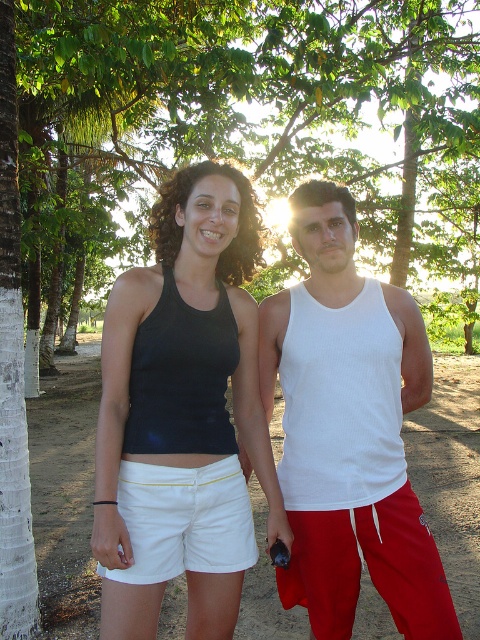
Does point (229, 353) come in front of point (239, 497)?

That is True.

Which is in front, point (99, 458) or point (186, 477)?

Positioned in front is point (99, 458).

The image size is (480, 640). In order to click on black matte tank top at center in this screenshot , I will do `click(182, 353)`.

What are the coordinates of `black matte tank top at center` in the screenshot? It's located at click(x=182, y=353).

Is white bark tree at center closer to camera compared to white ribbed tank top at center?

That is False.

Does point (177, 81) come in front of point (314, 548)?

No, (177, 81) is further to viewer.

I want to click on white bark tree at center, so (x=211, y=100).

Which is below, white ribbed tank top at center or white cotton shorts at center?

white cotton shorts at center

Between white ribbed tank top at center and white cotton shorts at center, which one has more height?

Standing taller between the two is white ribbed tank top at center.

This screenshot has height=640, width=480. What are the coordinates of `white ribbed tank top at center` in the screenshot? It's located at (348, 429).

Find the location of a particular element. white ribbed tank top at center is located at coordinates (348, 429).